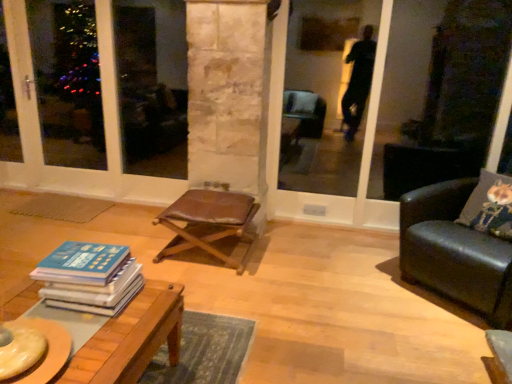
At what (x,y) coordinates should I click in order to perform the action: click on vacant space to the right of leather stool at center. Please return your answer as a coordinate pair (x, y). The image size is (512, 384). Looking at the image, I should click on (284, 259).